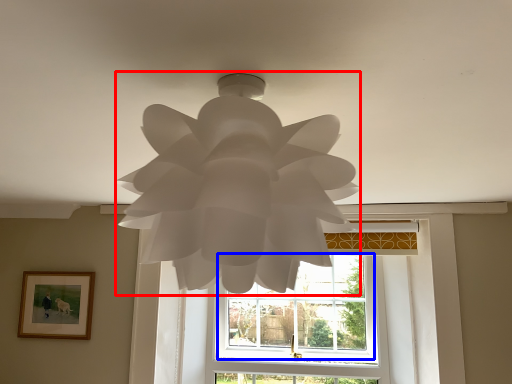
Question: Among these objects, which one is nearest to the camera, lamp (highlighted by a red box) or window (highlighted by a blue box)?

Choices:
 (A) lamp
 (B) window

Answer: (A)